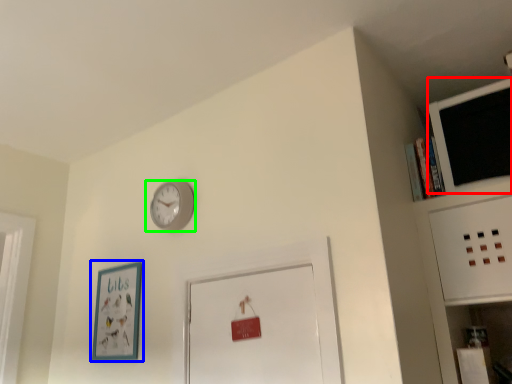
Question: Which is farther away from computer monitor (highlighted by a red box)? picture frame (highlighted by a blue box) or wall clock (highlighted by a green box)?

Choices:
 (A) picture frame
 (B) wall clock

Answer: (A)